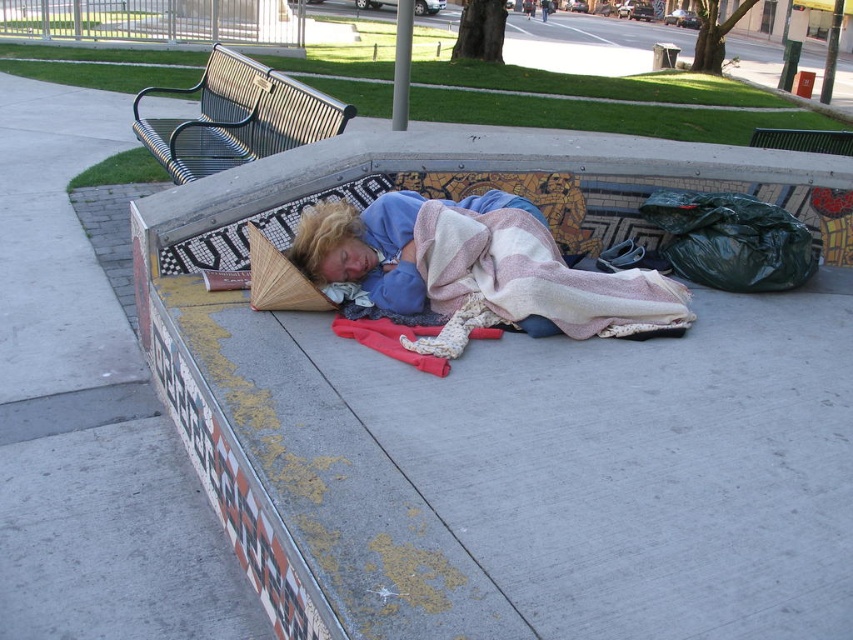
The height and width of the screenshot is (640, 853). Describe the element at coordinates (88, 417) in the screenshot. I see `concrete at lower left` at that location.

Is point (56, 289) behind point (195, 83)?

No, (56, 289) is in front of (195, 83).

Identify the location of concrete at lower left. This screenshot has width=853, height=640. (88, 417).

What are the coordinates of `concrete at lower left` in the screenshot? It's located at click(88, 417).

Identify the location of concrete at lower left. This screenshot has width=853, height=640. (88, 417).

Is point (351, 612) positioned in front of point (178, 170)?

Yes, it is in front of point (178, 170).

Does concrete bench at center have a lesser height compared to black metal bench at upper left?

In fact, concrete bench at center may be taller than black metal bench at upper left.

At what (x,y) coordinates should I click in order to perform the action: click on concrete bench at center. Please return your answer as a coordinate pair (x, y). Looking at the image, I should click on (519, 433).